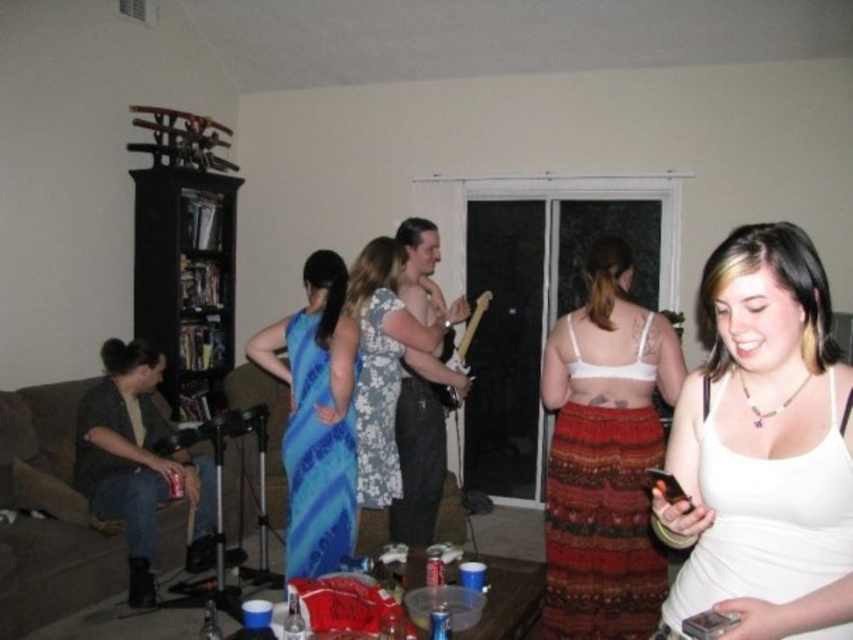
Question: Considering the relative positions of white tank top at center and floral-patterned fabric dress at center in the image provided, where is white tank top at center located with respect to floral-patterned fabric dress at center?

Choices:
 (A) left
 (B) right

Answer: (B)

Question: Which point is farther to the camera?

Choices:
 (A) floral-patterned fabric dress at center
 (B) white matte tank top at center
 (C) floral dress at center
 (D) blue satin dress at center

Answer: (A)

Question: Where is white tank top at center located in relation to blue satin dress at center in the image?

Choices:
 (A) above
 (B) below

Answer: (A)

Question: Observing the image, what is the correct spatial positioning of denim jacket at left in reference to floral-patterned fabric dress at center?

Choices:
 (A) right
 (B) left

Answer: (B)

Question: Estimate the real-world distances between objects in this image. Which object is farther from the denim jacket at left?

Choices:
 (A) white matte tank top at center
 (B) blue satin dress at center
 (C) floral dress at center
 (D) floral-patterned fabric dress at center

Answer: (A)

Question: Which point appears farthest from the camera in this image?

Choices:
 (A) (339, 470)
 (B) (792, 381)
 (C) (90, 481)

Answer: (C)